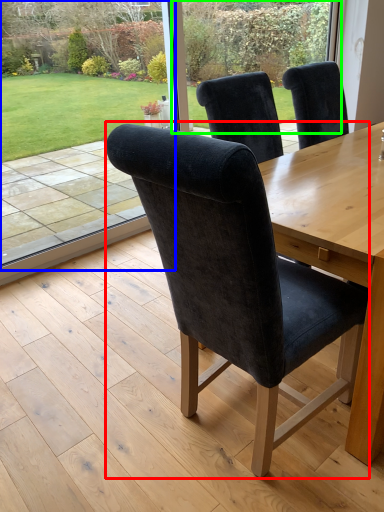
Question: Which object is the closest to the chair (highlighted by a red box)? Choose among these: window screen (highlighted by a blue box) or glass door (highlighted by a green box).

Choices:
 (A) window screen
 (B) glass door

Answer: (A)